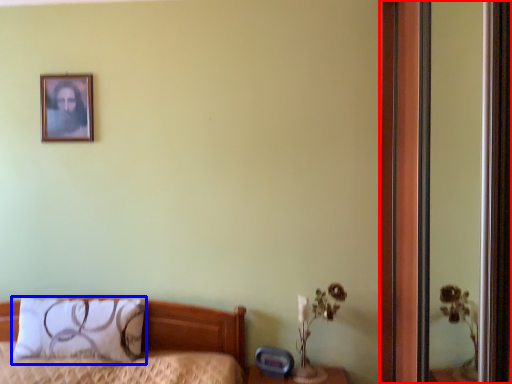
Question: Among these objects, which one is nearest to the camera, screen door (highlighted by a red box) or pillow (highlighted by a blue box)?

Choices:
 (A) screen door
 (B) pillow

Answer: (A)